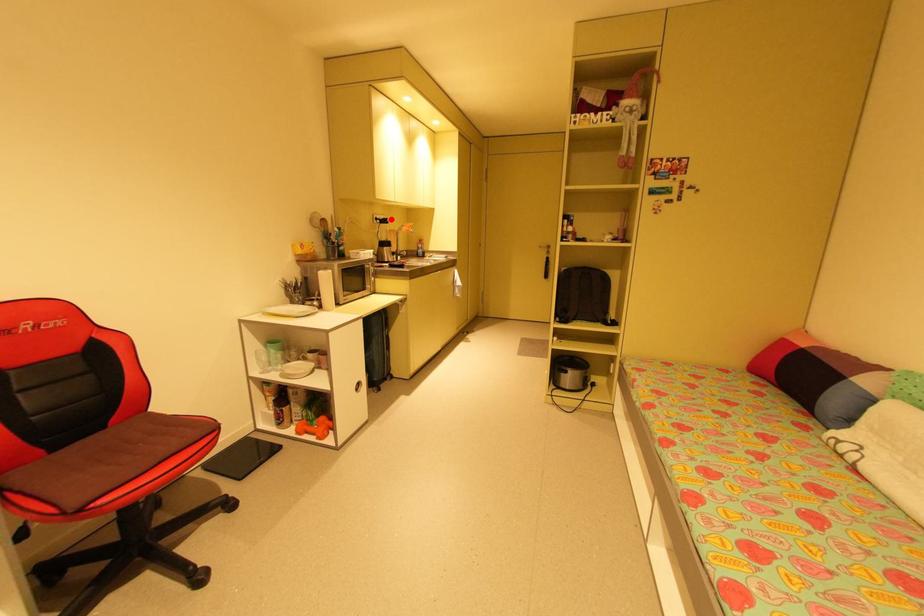
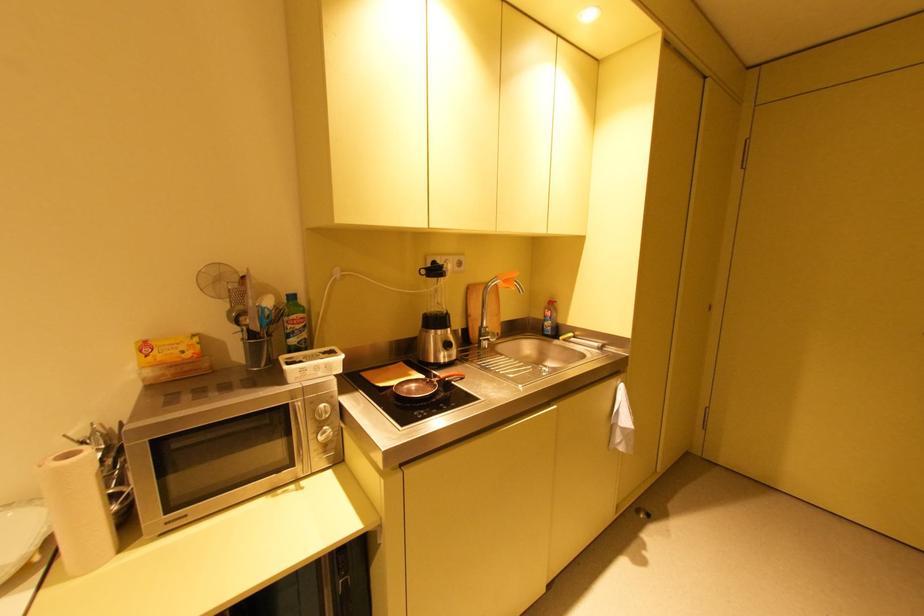
Find the pixel in the second image that matches the highlighted location in the first image.

(444, 267)